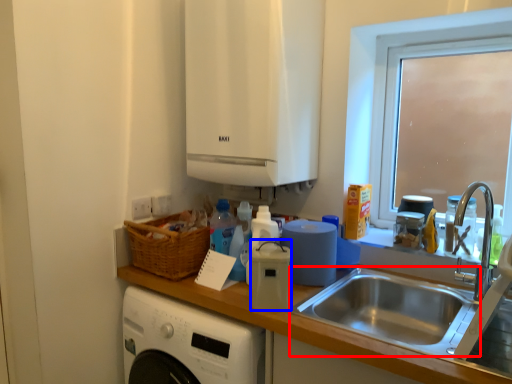
Question: Which object is closer to the camera taking this photo, sink (highlighted by a red box) or appliance (highlighted by a blue box)?

Choices:
 (A) sink
 (B) appliance

Answer: (A)